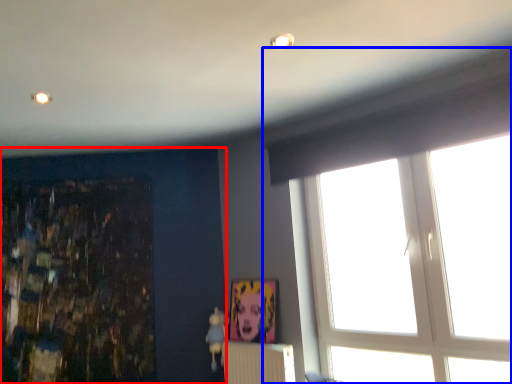
Question: Among these objects, which one is farthest to the camera, backdrop (highlighted by a red box) or window (highlighted by a blue box)?

Choices:
 (A) backdrop
 (B) window

Answer: (A)